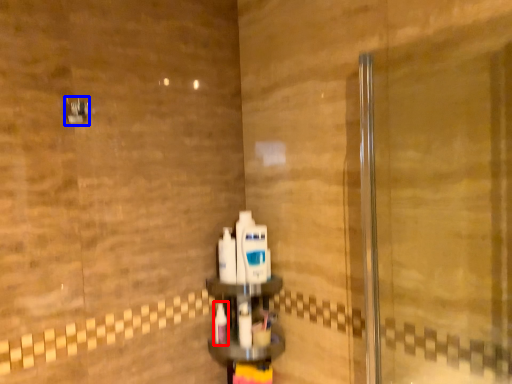
Question: Which of the following is the farthest to the observer, toothbrush (highlighted by a red box) or shower (highlighted by a blue box)?

Choices:
 (A) toothbrush
 (B) shower

Answer: (A)